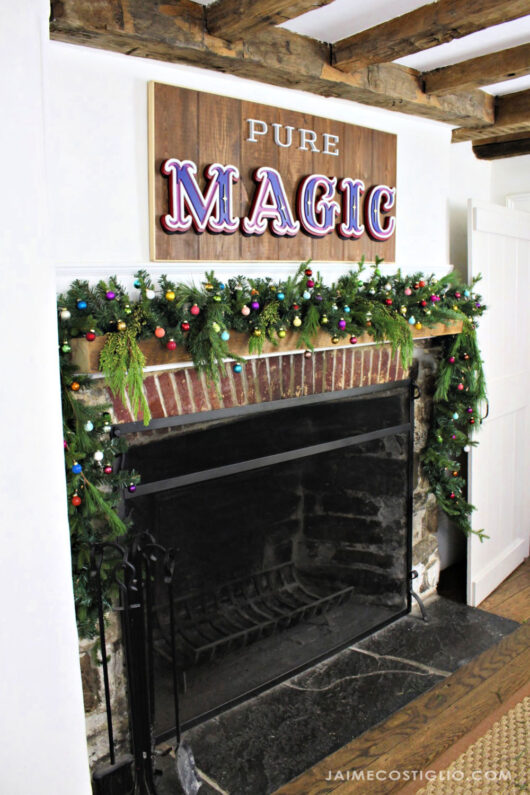
In order to click on textured carpet in this screenshot , I will do `click(511, 727)`, `click(494, 757)`.